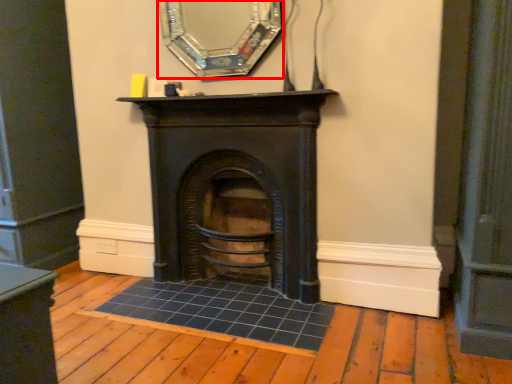
Question: From the image's perspective, where is mirror (annotated by the red box) located relative to fireplace?

Choices:
 (A) above
 (B) below

Answer: (A)